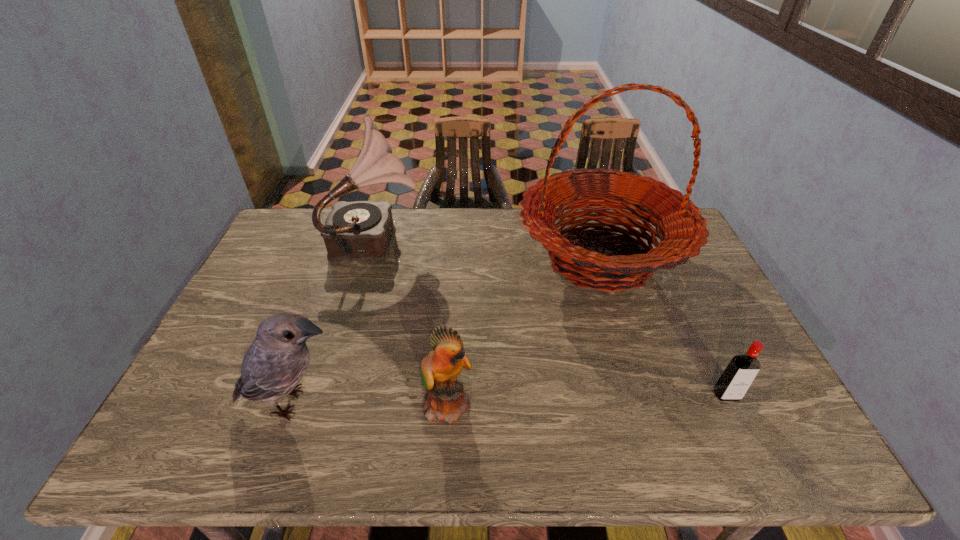
At what (x,y) coordinates should I click in order to perform the action: click on empty space that is in between the vodka and the tallest object. Please return your answer as a coordinate pair (x, y). This screenshot has width=960, height=540. Looking at the image, I should click on [663, 327].

Identify the location of free area in between the right parrot and the tallest object. The width and height of the screenshot is (960, 540). (524, 331).

I want to click on the closest object to the basket, so click(x=734, y=382).

Locate which object is the fourth closest to the left parrot. Please provide its 2D coordinates. Your answer should be formatted as a tuple, i.e. [(x, y)], where the tuple contains the x and y coordinates of a point satisfying the conditions above.

[(734, 382)]

Locate an element on the screen. Image resolution: width=960 pixels, height=540 pixels. vacant region that satisfies the following two spatial constraints: 1. from the horn of the record player; 2. on the right side of the tallest object is located at coordinates (373, 259).

This screenshot has height=540, width=960. Find the location of `free space that satisfies the following two spatial constraints: 1. on the front side of the tallest object; 2. on the front-facing side of the left parrot`. free space that satisfies the following two spatial constraints: 1. on the front side of the tallest object; 2. on the front-facing side of the left parrot is located at coordinates (646, 403).

Find the location of a particular element. The width and height of the screenshot is (960, 540). free space that satisfies the following two spatial constraints: 1. on the front and back of the shortest object; 2. on the front-facing side of the left parrot is located at coordinates (730, 403).

This screenshot has width=960, height=540. What are the coordinates of `vacant area in the image that satisfies the following two spatial constraints: 1. from the horn of the record player; 2. on the right side of the basket` in the screenshot? It's located at (373, 259).

Identify the location of vacant space that satisfies the following two spatial constraints: 1. from the horn of the basket; 2. on the left side of the second tallest object. Image resolution: width=960 pixels, height=540 pixels. (373, 259).

Locate an element on the screen. This screenshot has height=540, width=960. vacant space that satisfies the following two spatial constraints: 1. on the back side of the basket; 2. from the horn of the second tallest object is located at coordinates (594, 239).